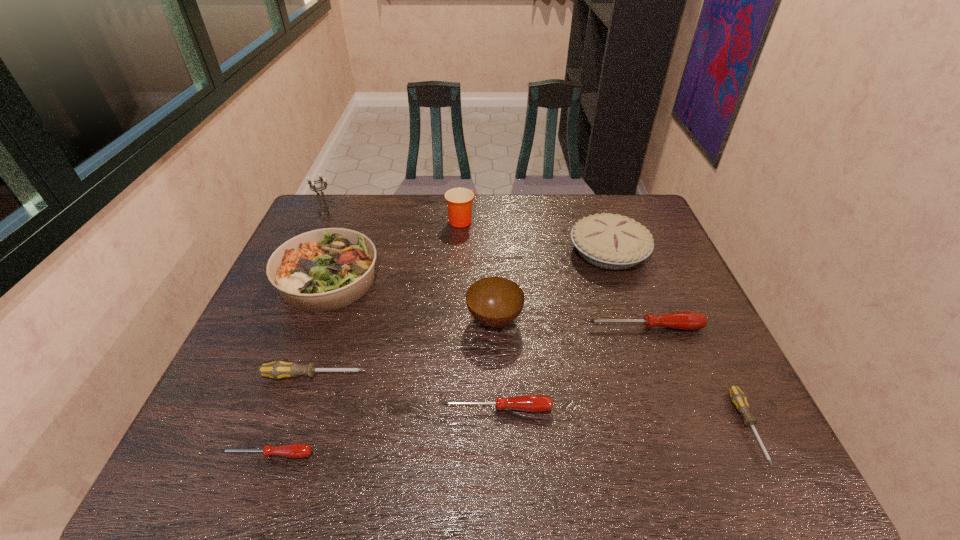
Where is `object at the far left corner`? Image resolution: width=960 pixels, height=540 pixels. object at the far left corner is located at coordinates (323, 208).

Where is `object located at the near left corner`? Image resolution: width=960 pixels, height=540 pixels. object located at the near left corner is located at coordinates (297, 450).

This screenshot has height=540, width=960. What are the coordinates of `object present at the far right corner` in the screenshot? It's located at (614, 242).

Identify the location of object at the near right corner. (738, 398).

Where is `blank space at the far edge of the desktop`? blank space at the far edge of the desktop is located at coordinates (478, 213).

Where is `blank area at the near edge`? blank area at the near edge is located at coordinates (362, 473).

Image resolution: width=960 pixels, height=540 pixels. I want to click on vacant space at the left edge, so click(224, 411).

Identify the location of vacant space at the right edge. This screenshot has width=960, height=540. (674, 350).

Locate an element on the screen. free location at the far right corner is located at coordinates tap(602, 200).

I want to click on vacant point at the near right corner, so click(752, 470).